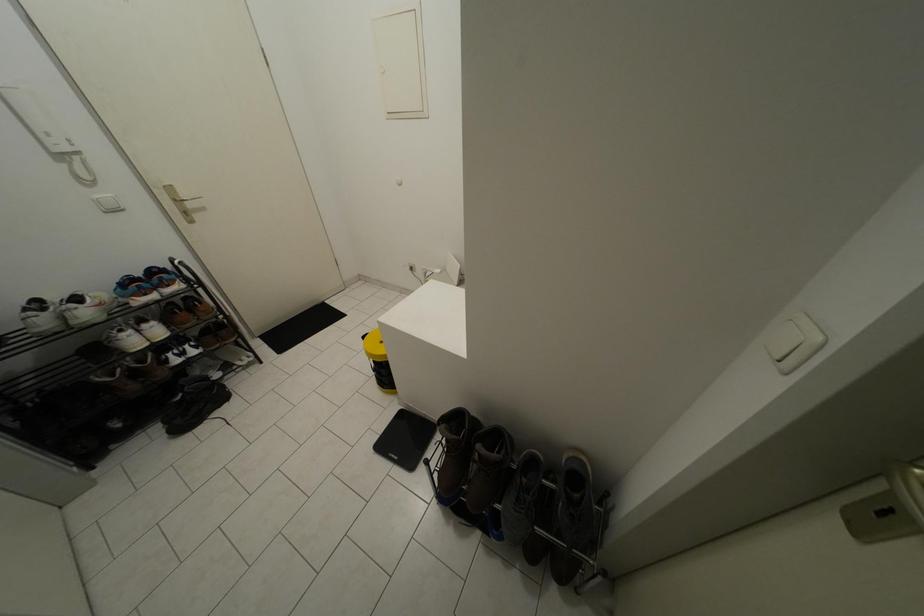
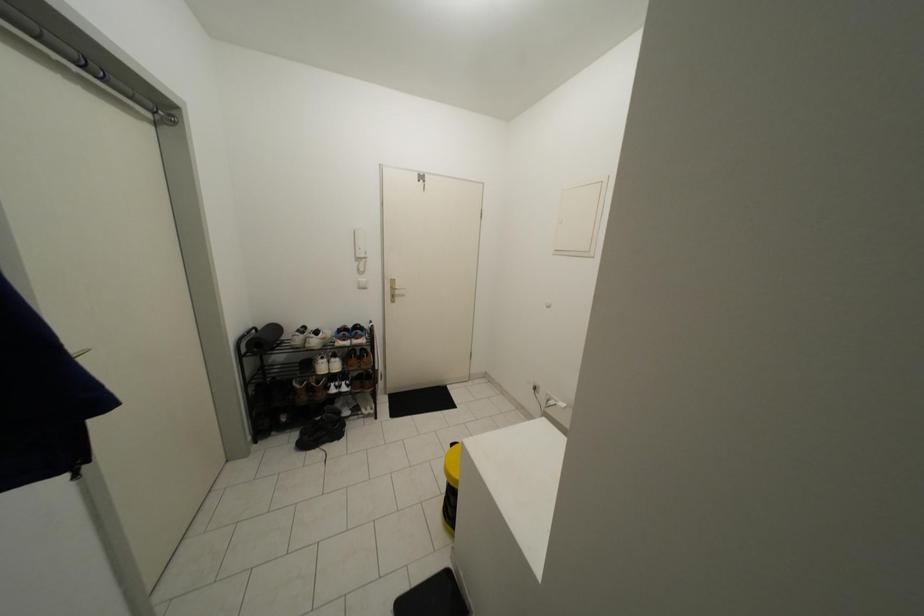
First-person continuous shooting, in which direction is the camera rotating?

The camera's rotation is toward left-up.